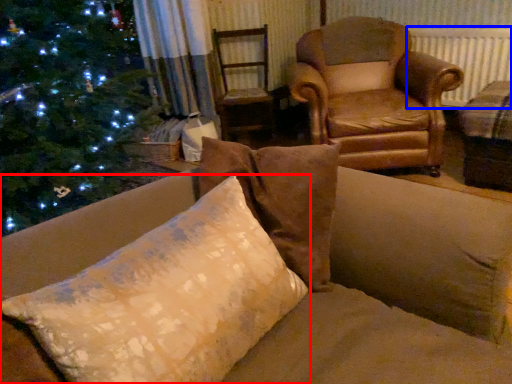
Question: Which object is closer to the camera taking this photo, pillow (highlighted by a red box) or radiator (highlighted by a blue box)?

Choices:
 (A) pillow
 (B) radiator

Answer: (A)